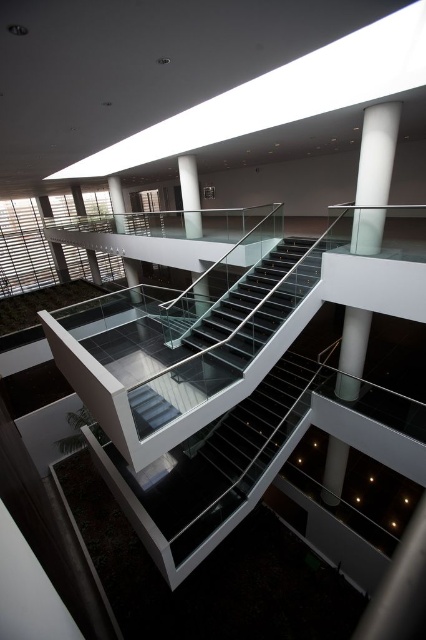
You are standing at the bottom of the staircase in this modern interior. You notice a point marked at coordinates (374, 177). Which object does this point correspond to?

The point at coordinates (374, 177) corresponds to the white glossy column at upper center.

You are standing at point (181, 170) and want to walk to the other point. Given that your walking speed is 3 feet per second, how many seconds will it take you to reach the destination?

The distance between the two points is 39.15 feet, so it will take 39.15 divided by 3 equals 13.05 seconds to reach the destination.

You are standing at the entrance of the staircase and want to reach the balcony on the upper level. There is a white glossy column at upper center in your path. Based on its position, can you walk around it to reach the balcony?

The white glossy column at upper center is located at point (374, 177), which suggests it is positioned to the left side of the upper area. Since the staircase curves gently to the right, you can walk around the column on the right side to reach the balcony.